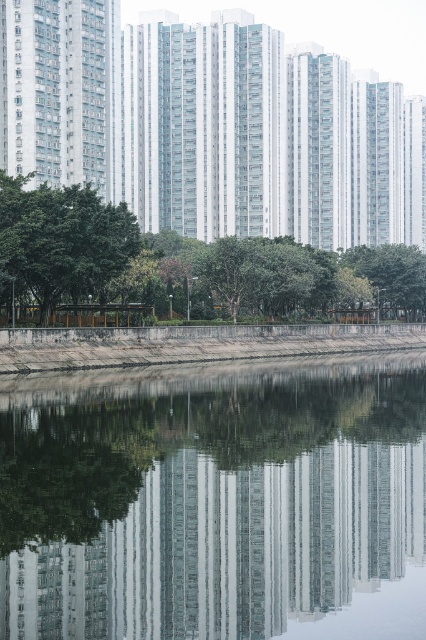
Is point (154, 634) positioned before point (201, 353)?

Yes, point (154, 634) is closer to viewer.

Which is behind, point (353, 586) or point (77, 332)?

Positioned behind is point (77, 332).

The image size is (426, 640). Describe the element at coordinates (215, 502) in the screenshot. I see `transparent glass water at center` at that location.

This screenshot has width=426, height=640. What are the coordinates of `transparent glass water at center` in the screenshot? It's located at (215, 502).

Is point (293, 333) closer to viewer compared to point (17, 262)?

No, (293, 333) is behind (17, 262).

Is dull concrete wall at lower center to the left of green leafy tree at lower left from the viewer's perspective?

No, dull concrete wall at lower center is not to the left of green leafy tree at lower left.

The width and height of the screenshot is (426, 640). What are the coordinates of `dull concrete wall at lower center` in the screenshot? It's located at (192, 342).

Locate an element on the screen. The width and height of the screenshot is (426, 640). dull concrete wall at lower center is located at coordinates (192, 342).

Does green leafy tree at center come in front of dull concrete wall at lower center?

No, it is not.

This screenshot has width=426, height=640. What do you see at coordinates (184, 264) in the screenshot?
I see `green leafy tree at center` at bounding box center [184, 264].

Is point (236, 243) in front of point (296, 346)?

No, (236, 243) is further to viewer.

The image size is (426, 640). What are the coordinates of `green leafy tree at center` in the screenshot? It's located at (184, 264).